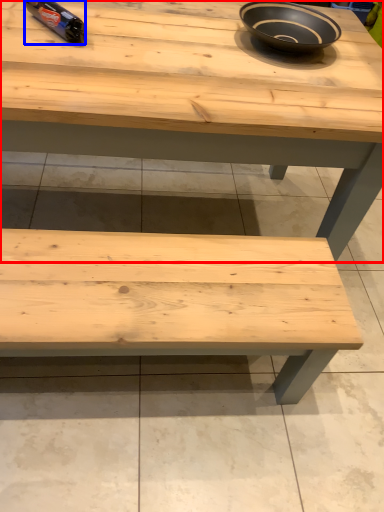
Question: Which of the following is the farthest to the observer, table (highlighted by a red box) or bottle (highlighted by a blue box)?

Choices:
 (A) table
 (B) bottle

Answer: (B)